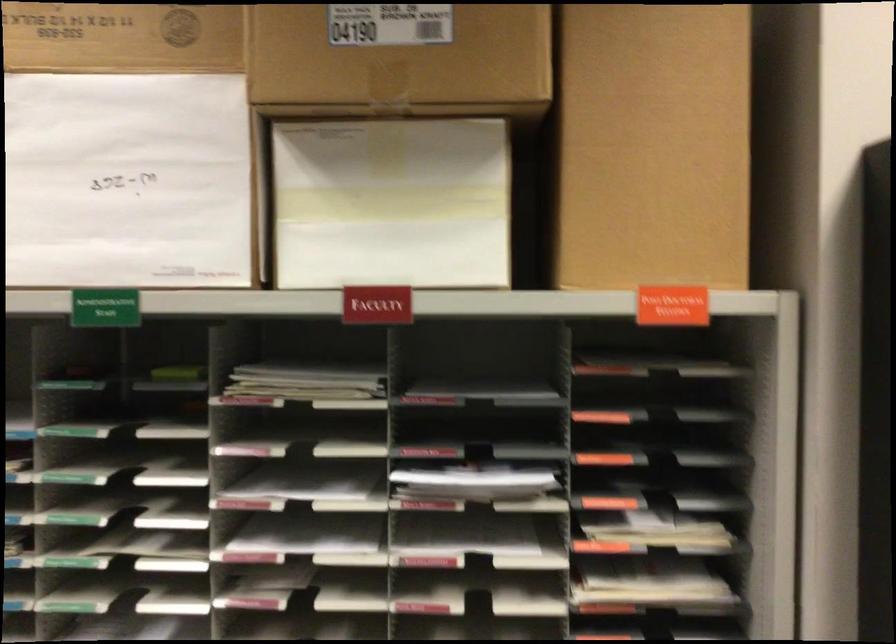
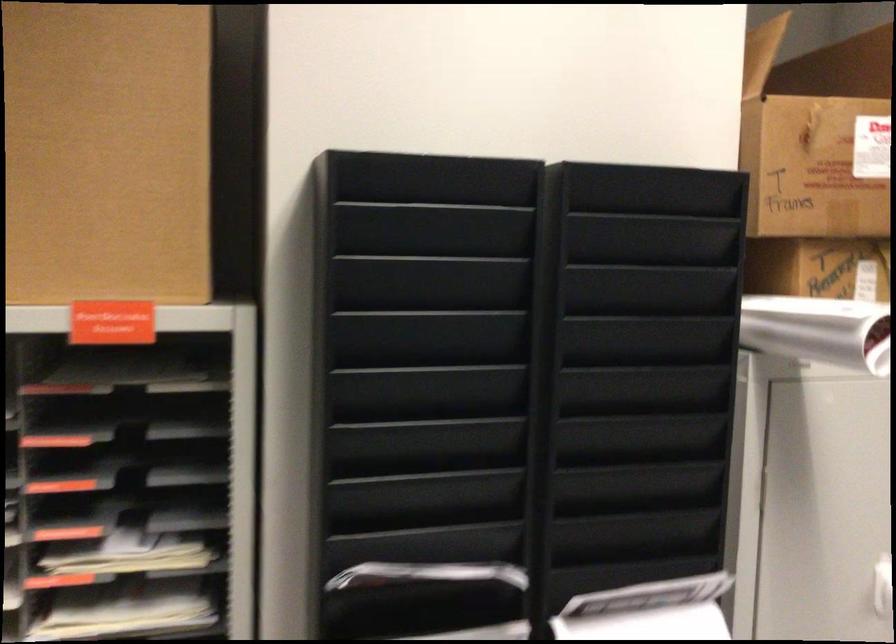
Question: How did the camera likely rotate?

Choices:
 (A) Left
 (B) Right
 (C) Up
 (D) Down

Answer: (B)